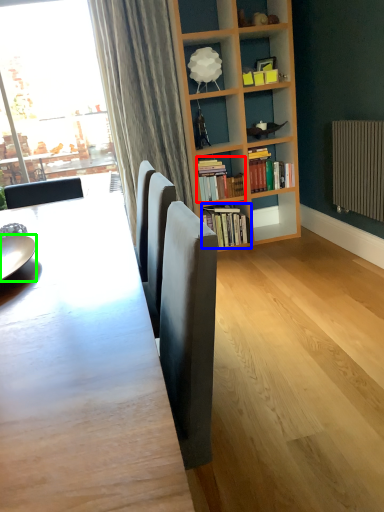
Question: Considering the real-world distances, which object is farthest from book (highlighted by a red box)? book (highlighted by a blue box) or plate (highlighted by a green box)?

Choices:
 (A) book
 (B) plate

Answer: (B)